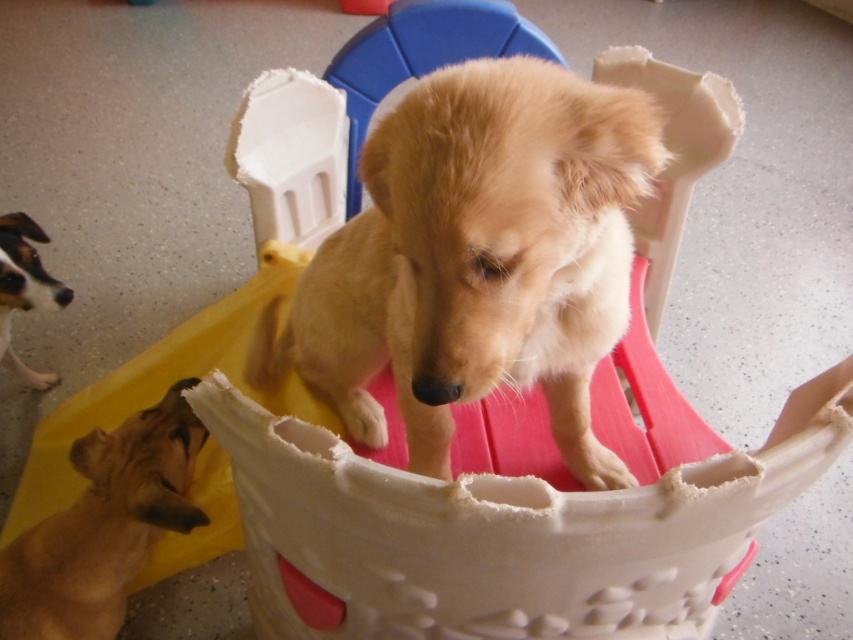
You are a dog owner trying to locate your two dogs in the backyard. You see the golden fur puppy at center and the white fur dog at lower left. Which dog is closer to the right side of the backyard?

The golden fur puppy at center is positioned on the right side of white fur dog at lower left, so the golden fur puppy at center is closer to the right side of the backyard.

You are a dog owner who wants to ensure both puppies can play safely in the play structure. Given that the golden fur puppy at center is bigger than the brown furry dog at upper center, which puppy might need more space to move around comfortably inside the play structure?

The golden fur puppy at center, being larger in size compared to the brown furry dog at upper center, would require more space to move around comfortably inside the play structure.

You are a photographer trying to capture a clear photo of both the brown furry dog at upper center and the white fur dog at lower left. Based on their positions, which dog should you focus on first to ensure both are in focus?

You should focus on the brown furry dog at upper center first because it is in front of the white fur dog at lower left, so adjusting focus starting from the closer subject will help both be in focus.